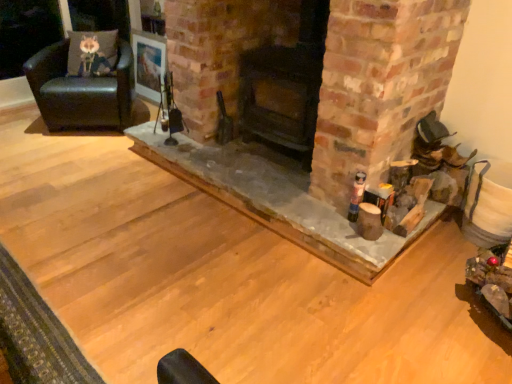
Question: Can you confirm if fuzzy fabric pillow at upper left is thinner than black leather chair at left?

Choices:
 (A) no
 (B) yes

Answer: (B)

Question: Considering the relative sizes of fuzzy fabric pillow at upper left and black leather chair at left in the image provided, is fuzzy fabric pillow at upper left smaller than black leather chair at left?

Choices:
 (A) no
 (B) yes

Answer: (B)

Question: Is fuzzy fabric pillow at upper left far away from black leather chair at left?

Choices:
 (A) yes
 (B) no

Answer: (B)

Question: Can we say fuzzy fabric pillow at upper left lies outside black leather chair at left?

Choices:
 (A) no
 (B) yes

Answer: (A)

Question: Is fuzzy fabric pillow at upper left next to black leather chair at left?

Choices:
 (A) no
 (B) yes

Answer: (A)

Question: Can black leather chair at left be found inside fuzzy fabric pillow at upper left?

Choices:
 (A) no
 (B) yes

Answer: (A)

Question: From the image's perspective, would you say smooth stone fireplace at center, which is the second fireplace in right-to-left order, is positioned over black leather chair at left?

Choices:
 (A) yes
 (B) no

Answer: (B)

Question: Can you confirm if smooth stone fireplace at center, which is the 1th fireplace in left-to-right order, is thinner than black leather chair at left?

Choices:
 (A) no
 (B) yes

Answer: (A)

Question: From a real-world perspective, does smooth stone fireplace at center, which is the 1th fireplace in left-to-right order, sit lower than black leather chair at left?

Choices:
 (A) no
 (B) yes

Answer: (B)

Question: Is smooth stone fireplace at center, which is the second fireplace in right-to-left order, far away from black leather chair at left?

Choices:
 (A) yes
 (B) no

Answer: (A)

Question: Considering the relative sizes of smooth stone fireplace at center, which is the second fireplace in right-to-left order, and black leather chair at left in the image provided, is smooth stone fireplace at center, which is the second fireplace in right-to-left order, smaller than black leather chair at left?

Choices:
 (A) no
 (B) yes

Answer: (A)

Question: Can you see smooth stone fireplace at center, which is the second fireplace in right-to-left order, touching black leather chair at left?

Choices:
 (A) yes
 (B) no

Answer: (B)

Question: From a real-world perspective, does wooden frame at upper center sit lower than smooth stone fireplace at center, which is the second fireplace in right-to-left order?

Choices:
 (A) yes
 (B) no

Answer: (B)